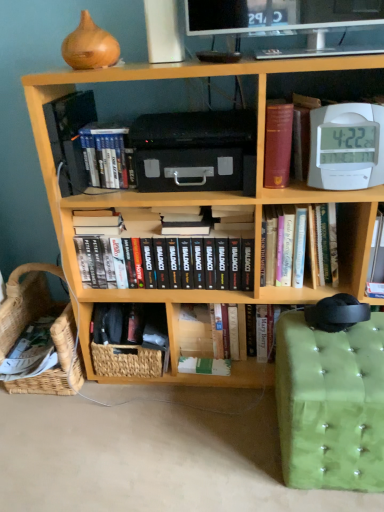
At what (x,y) coordinates should I click in order to perform the action: click on free space to the left of white paper at center, the second paperback book positioned from the back. Please return your answer as a coordinate pair (x, y). The image size is (384, 512). Looking at the image, I should click on (168, 392).